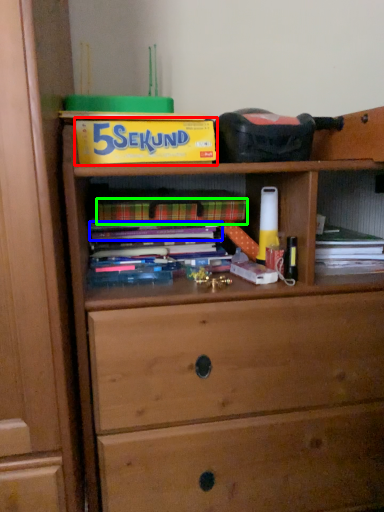
Question: Based on their relative distances, which object is farther from paperback book (highlighted by a red box)? Choose from book (highlighted by a blue box) and paperback book (highlighted by a green box).

Choices:
 (A) book
 (B) paperback book

Answer: (A)